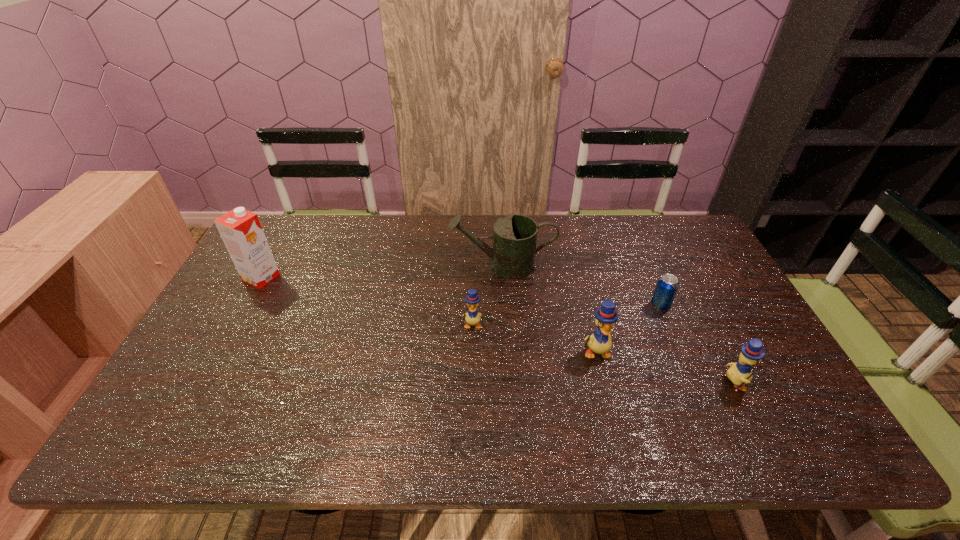
Identify which object is the fifth closest to the watering can. Please provide its 2D coordinates. Your answer should be formatted as a tuple, i.e. [(x, y)], where the tuple contains the x and y coordinates of a point satisfying the conditions above.

[(241, 231)]

Image resolution: width=960 pixels, height=540 pixels. Identify the location of duckling that is the second closest one to the watering can. (599, 342).

The height and width of the screenshot is (540, 960). Identify the location of duckling that stands as the closest to the farthest duckling. (599, 342).

Identify the location of vacant space that satisfies the following two spatial constraints: 1. on the back side of the shortest object; 2. with the spout on the watering can. (643, 266).

You are a GUI agent. You are given a task and a screenshot of the screen. Output one action in this format:
    pyautogui.click(x=<x>, y=<y>)
    Task: Click on the blank space that satisfies the following two spatial constraints: 1. with the spout on the watering can; 2. on the right side of the second object from right to left
    Image resolution: width=960 pixels, height=540 pixels.
    Given the screenshot: What is the action you would take?
    pyautogui.click(x=504, y=306)